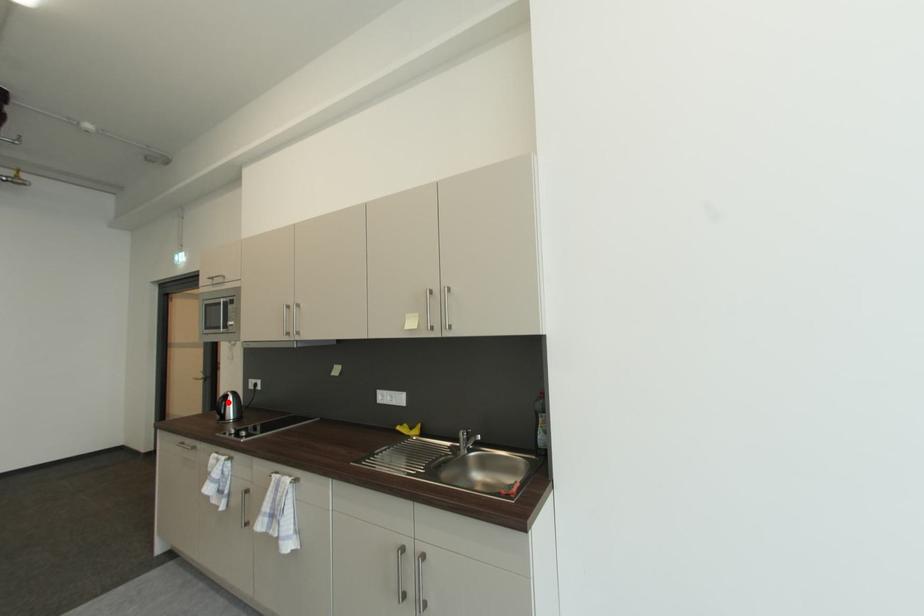
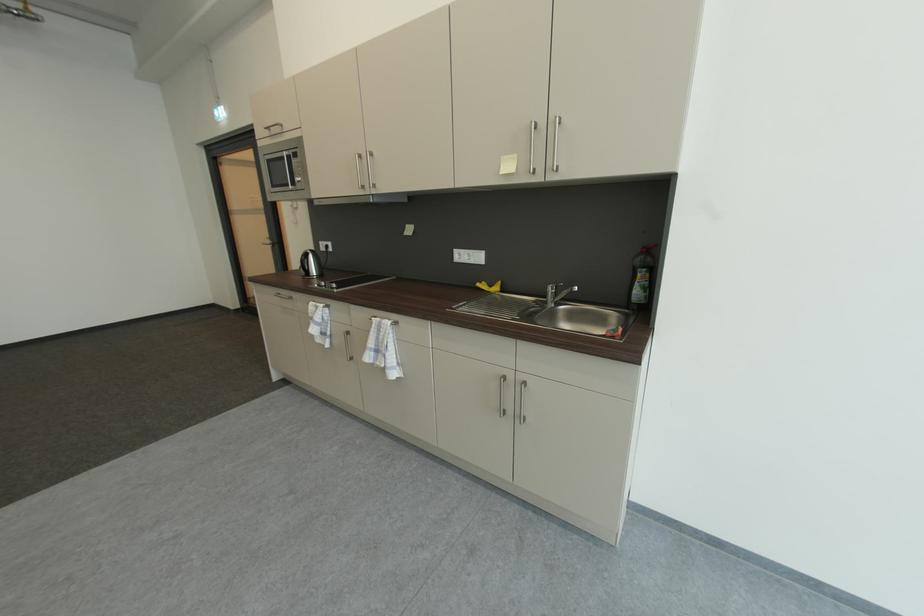
The point at the highlighted location is marked in the first image. Where is the corresponding point in the second image?

(310, 259)